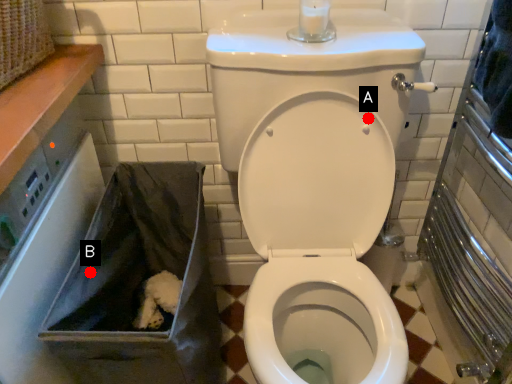
Question: Two points are circled on the image, labeled by A and B beside each circle. Among these points, which one is nearest to the camera?

Choices:
 (A) A is closer
 (B) B is closer

Answer: (B)